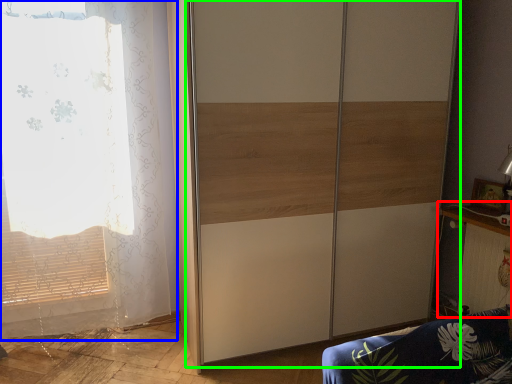
Question: Based on their relative distances, which object is nearer to table (highlighted by a red box)? Choose from curtain (highlighted by a blue box) and screen door (highlighted by a green box).

Choices:
 (A) curtain
 (B) screen door

Answer: (B)